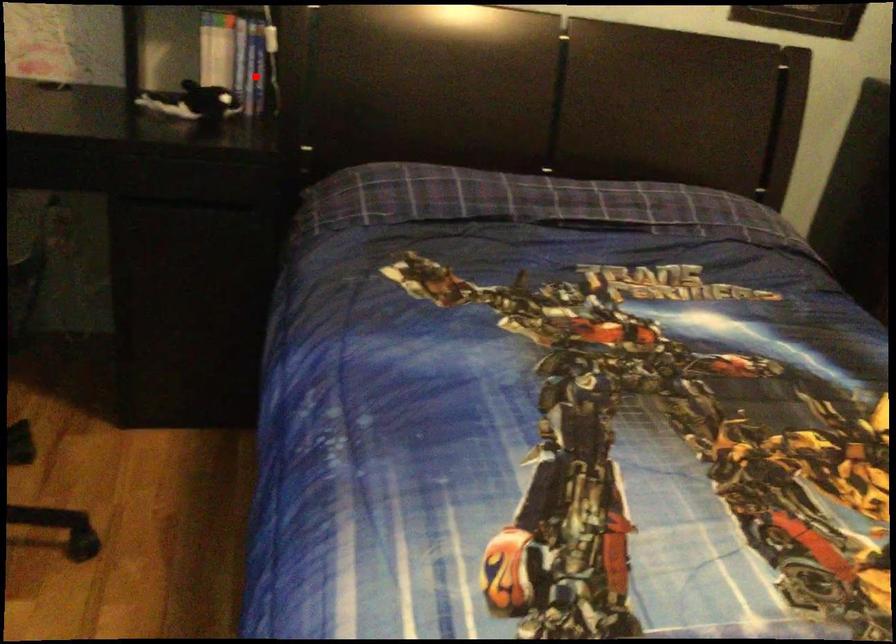
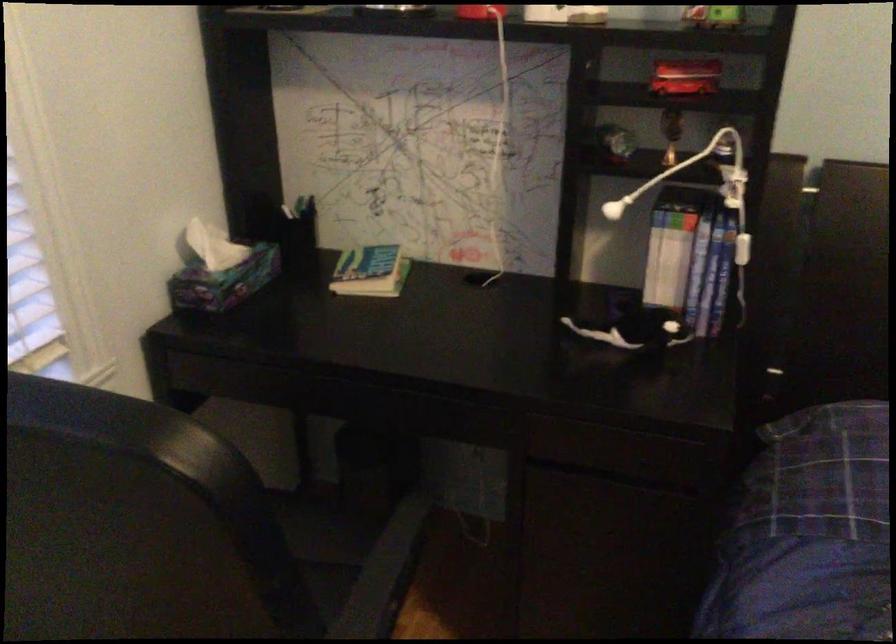
Question: I am providing you with two images of the same scene from different viewpoints. A red point is shown in image1. For the corresponding object point in image2, is it positioned nearer or farther from the camera?

Choices:
 (A) Nearer
 (B) Farther

Answer: (A)